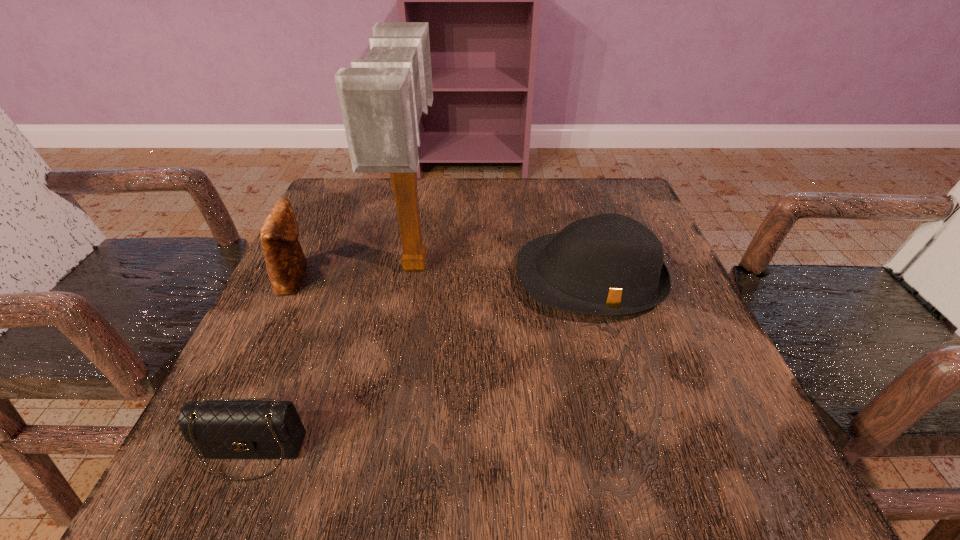
The width and height of the screenshot is (960, 540). Find the location of `unoccupied position between the fedora and the taller clutch bag`. unoccupied position between the fedora and the taller clutch bag is located at coordinates (443, 278).

Locate an element on the screen. vacant point located between the nearest object and the taller clutch bag is located at coordinates (274, 364).

You are a GUI agent. You are given a task and a screenshot of the screen. Output one action in this format:
    pyautogui.click(x=<x>, y=<y>)
    Task: Click on the vacant area between the farther clutch bag and the shortest object
    The height and width of the screenshot is (540, 960).
    Given the screenshot: What is the action you would take?
    pyautogui.click(x=274, y=364)

This screenshot has height=540, width=960. In order to click on free space that is in between the farther clutch bag and the rightmost object in this screenshot , I will do `click(443, 278)`.

In order to click on empty space that is in between the shortest object and the mallet in this screenshot , I will do `click(334, 358)`.

Identify the location of vacant point located between the nearest object and the taller clutch bag. (274, 364).

You are a GUI agent. You are given a task and a screenshot of the screen. Output one action in this format:
    pyautogui.click(x=<x>, y=<y>)
    Task: Click on the vacant region between the rightmost object and the farther clutch bag
    This screenshot has width=960, height=540.
    Given the screenshot: What is the action you would take?
    pyautogui.click(x=443, y=278)

This screenshot has height=540, width=960. Identify the location of vacant point located between the tallest object and the nearer clutch bag. [x=334, y=358].

This screenshot has height=540, width=960. What are the coordinates of `free space that is in between the mallet and the rightmost object` in the screenshot? It's located at (503, 271).

This screenshot has height=540, width=960. Find the location of `vacant area between the fedora and the farther clutch bag`. vacant area between the fedora and the farther clutch bag is located at coordinates (443, 278).